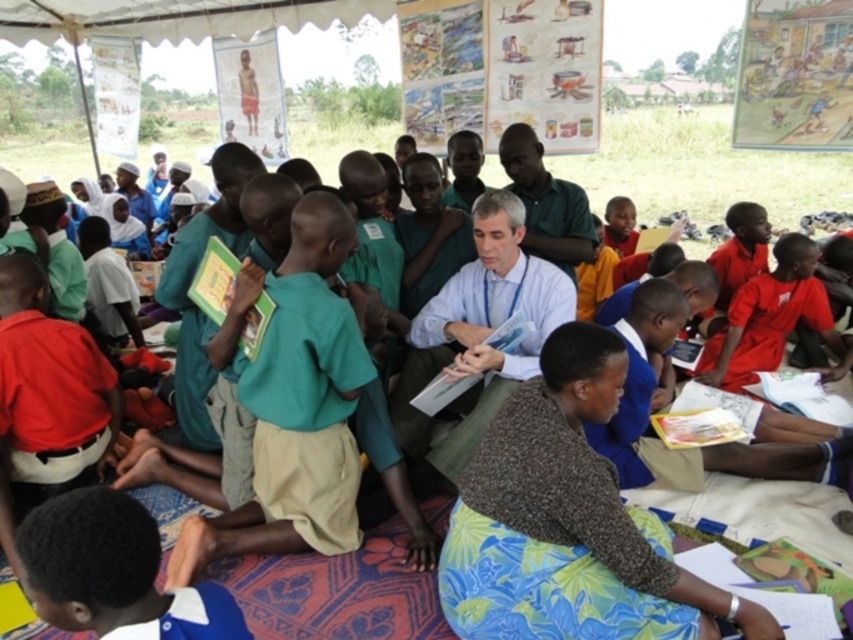
You are a photographer standing at the back of the group. You want to take a photo of both the red cotton shirt at right and the green fabric shirt at center. Which shirt should you position closer to the center of the frame to include both in the photo?

The red cotton shirt at right is positioned on the right side of green fabric shirt at center. To include both in the photo, position the green fabric shirt at center closer to the center of the frame so that the red cotton shirt at right can also be captured on its right side.

You are a photographer standing in front of the educational scene. You want to take a photo that includes both the point at coordinates point (773,310) and point (561,252). Which point should be placed closer to the camera in the photo?

Point (773,310) is further to the camera than point (561,252), so you should place point (773,310) closer to the camera in the photo.